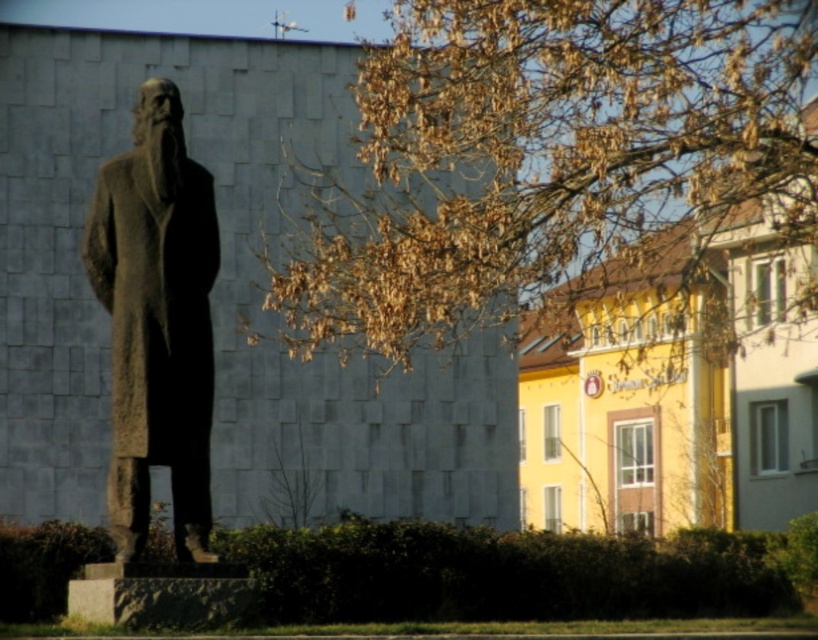
You are standing in front of the statue and want to take a photo that includes both the statue and the yellow building in the background. The statue is at point (727, 173) and the yellow building is at point (120, 257). Which point should you focus on to ensure both are in focus?

You should focus on point (727, 173) because it is closer to the camera than point (120, 257), ensuring both are within the depth of field.

You are an architect analyzing the spatial arrangement of the scene. Based on the statue and its surroundings, can you determine if the brown leafy branches at upper center are positioned higher than the rough stone robe at left?

The brown leafy branches at upper center is above rough stone robe at left, so yes, the branches are positioned higher than the robe.